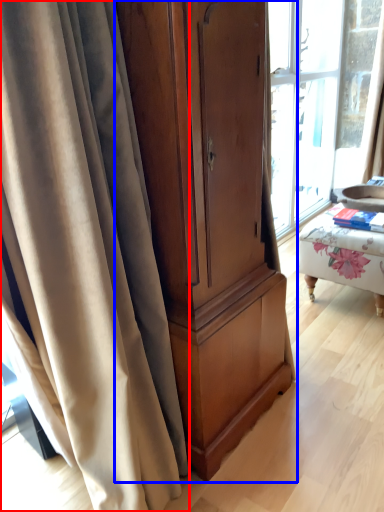
Question: Which point is further to the camera, curtain (highlighted by a red box) or cabinetry (highlighted by a blue box)?

Choices:
 (A) curtain
 (B) cabinetry

Answer: (B)